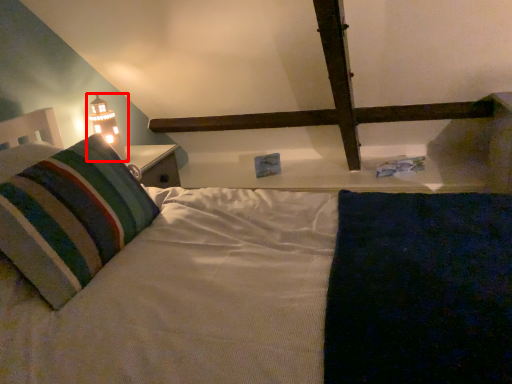
Question: From the image, what is the correct spatial relationship of table lamp (annotated by the red box) in relation to pillow?

Choices:
 (A) left
 (B) right

Answer: (B)